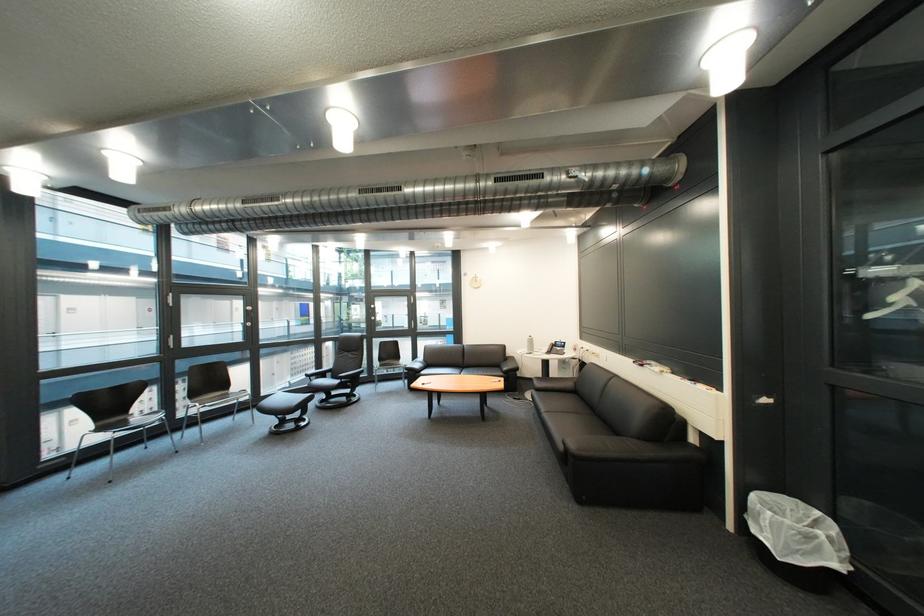
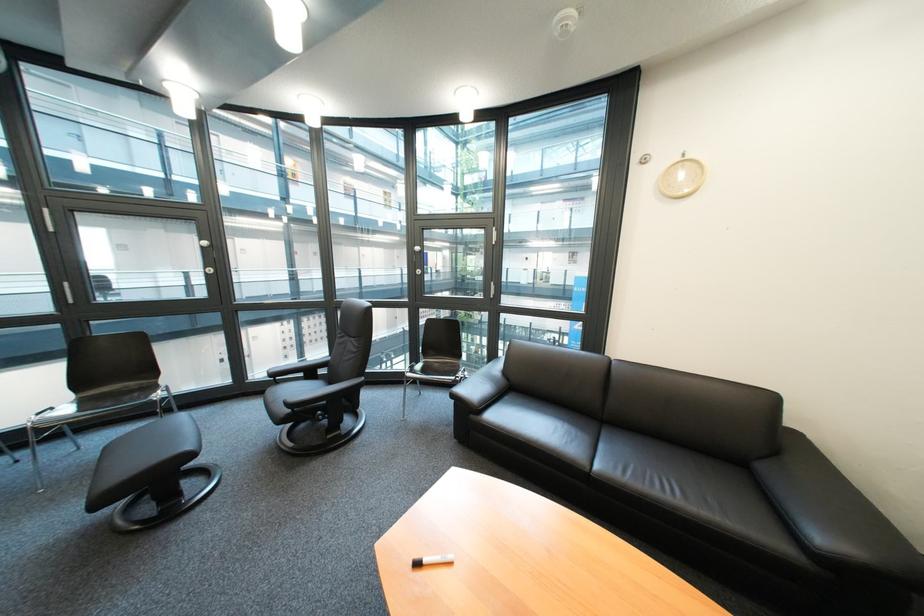
Find the pixel in the second image that matches point (518, 371) in the first image.

(833, 540)